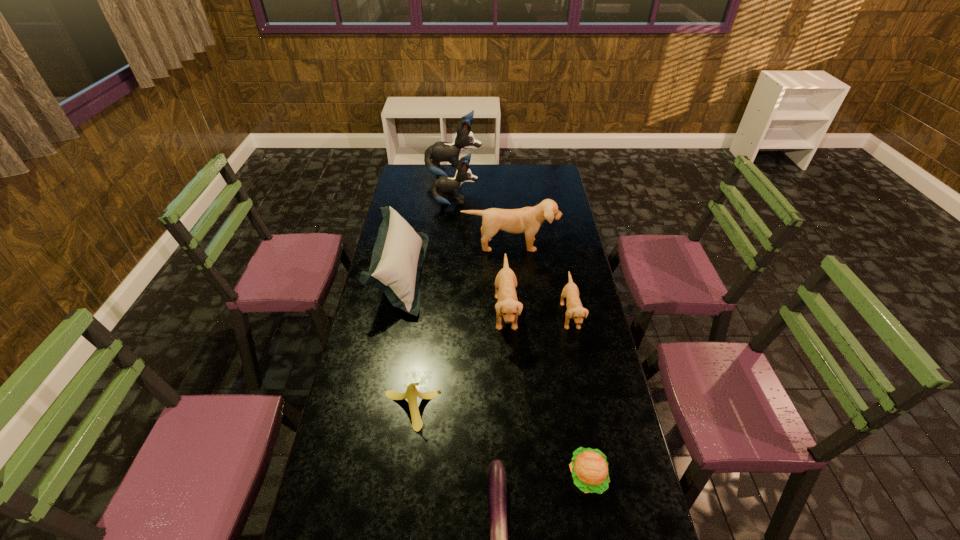
In order to click on vacant space located 0.190m on the left side of the smallest beige puppy in this screenshot , I will do `click(512, 316)`.

The width and height of the screenshot is (960, 540). In order to click on vacant space located 0.140m on the front of the banana in this screenshot , I will do `click(402, 478)`.

This screenshot has height=540, width=960. I want to click on vacant space located 0.150m on the left of the second shortest object, so click(x=516, y=477).

Where is `object at the far edge`? Image resolution: width=960 pixels, height=540 pixels. object at the far edge is located at coordinates (440, 151).

At what (x,y) coordinates should I click in order to perform the action: click on puppy that is at the left edge. Please return your answer as a coordinate pair (x, y). The width and height of the screenshot is (960, 540). Looking at the image, I should click on (440, 151).

The height and width of the screenshot is (540, 960). In order to click on cushion located at the left edge in this screenshot , I will do `click(398, 254)`.

Find the location of a particular element. The image size is (960, 540). banana that is positioned at the left edge is located at coordinates (411, 393).

This screenshot has width=960, height=540. I want to click on hamburger positioned at the right edge, so click(x=589, y=467).

You are a GUI agent. You are given a task and a screenshot of the screen. Output one action in this format:
    pyautogui.click(x=<x>, y=<y>)
    Task: Click on the object positioned at the far left corner
    Image resolution: width=960 pixels, height=540 pixels.
    Given the screenshot: What is the action you would take?
    440,151

Find the location of a particular element. The height and width of the screenshot is (540, 960). free location at the far edge of the desktop is located at coordinates (522, 165).